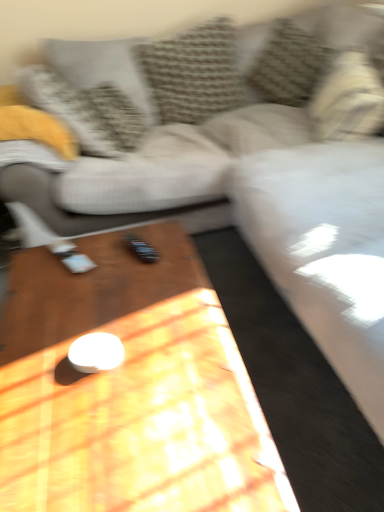
Question: Is textured gray pillow at upper center, which is the 4th pillow in left-to-right order, positioned with its back to textured gray pillow at upper left, the 5th pillow when ordered from right to left?

Choices:
 (A) no
 (B) yes

Answer: (A)

Question: Does textured gray pillow at upper center, which is the 4th pillow in left-to-right order, have a smaller size compared to textured gray pillow at upper left, placed as the 1th pillow when sorted from left to right?

Choices:
 (A) yes
 (B) no

Answer: (B)

Question: Can you confirm if textured gray pillow at upper center, the 2th pillow in the right-to-left sequence, is shorter than textured gray pillow at upper left, the 5th pillow when ordered from right to left?

Choices:
 (A) no
 (B) yes

Answer: (B)

Question: Is the depth of textured gray pillow at upper center, which is the 4th pillow in left-to-right order, greater than that of textured gray pillow at upper left, the 5th pillow when ordered from right to left?

Choices:
 (A) yes
 (B) no

Answer: (B)

Question: From the image's perspective, would you say textured gray pillow at upper center, which is the 4th pillow in left-to-right order, is positioned over textured gray pillow at upper left, the 5th pillow when ordered from right to left?

Choices:
 (A) no
 (B) yes

Answer: (B)

Question: Considering the relative positions of textured gray pillow at upper center, which is the 4th pillow in left-to-right order, and textured gray pillow at upper left, the 5th pillow when ordered from right to left, in the image provided, is textured gray pillow at upper center, which is the 4th pillow in left-to-right order, in front of textured gray pillow at upper left, the 5th pillow when ordered from right to left,?

Choices:
 (A) yes
 (B) no

Answer: (A)

Question: Can you confirm if textured beige pillow at upper center, the 3th pillow in the right-to-left sequence, is shorter than textured gray pillow at upper left, placed as the 1th pillow when sorted from left to right?

Choices:
 (A) no
 (B) yes

Answer: (B)

Question: Could you tell me if textured beige pillow at upper center, which ranks as the third pillow in left-to-right order, is facing textured gray pillow at upper left, placed as the 1th pillow when sorted from left to right?

Choices:
 (A) yes
 (B) no

Answer: (B)

Question: Can you confirm if textured beige pillow at upper center, which ranks as the third pillow in left-to-right order, is smaller than textured gray pillow at upper left, placed as the 1th pillow when sorted from left to right?

Choices:
 (A) no
 (B) yes

Answer: (A)

Question: Does textured beige pillow at upper center, which ranks as the third pillow in left-to-right order, have a greater height compared to textured gray pillow at upper left, the 5th pillow when ordered from right to left?

Choices:
 (A) no
 (B) yes

Answer: (A)

Question: From the image's perspective, is textured beige pillow at upper center, which ranks as the third pillow in left-to-right order, below textured gray pillow at upper left, placed as the 1th pillow when sorted from left to right?

Choices:
 (A) yes
 (B) no

Answer: (B)

Question: Can you confirm if textured beige pillow at upper center, which ranks as the third pillow in left-to-right order, is thinner than textured gray pillow at upper left, placed as the 1th pillow when sorted from left to right?

Choices:
 (A) yes
 (B) no

Answer: (B)

Question: Considering the relative positions of wooden coffee table at center and textured gray pillow at upper left, placed as the 1th pillow when sorted from left to right, in the image provided, is wooden coffee table at center to the left of textured gray pillow at upper left, placed as the 1th pillow when sorted from left to right, from the viewer's perspective?

Choices:
 (A) yes
 (B) no

Answer: (B)